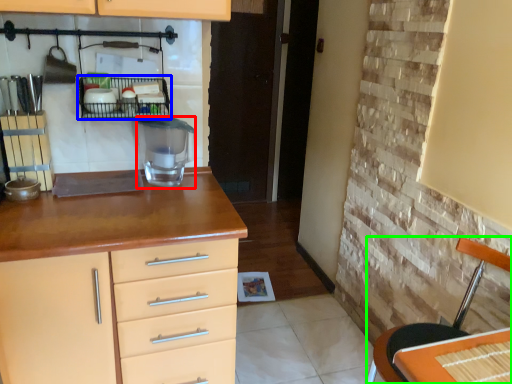
Question: Considering the real-world distances, which object is closest to appliance (highlighted by a red box)? shelf (highlighted by a blue box) or chair (highlighted by a green box).

Choices:
 (A) shelf
 (B) chair

Answer: (A)